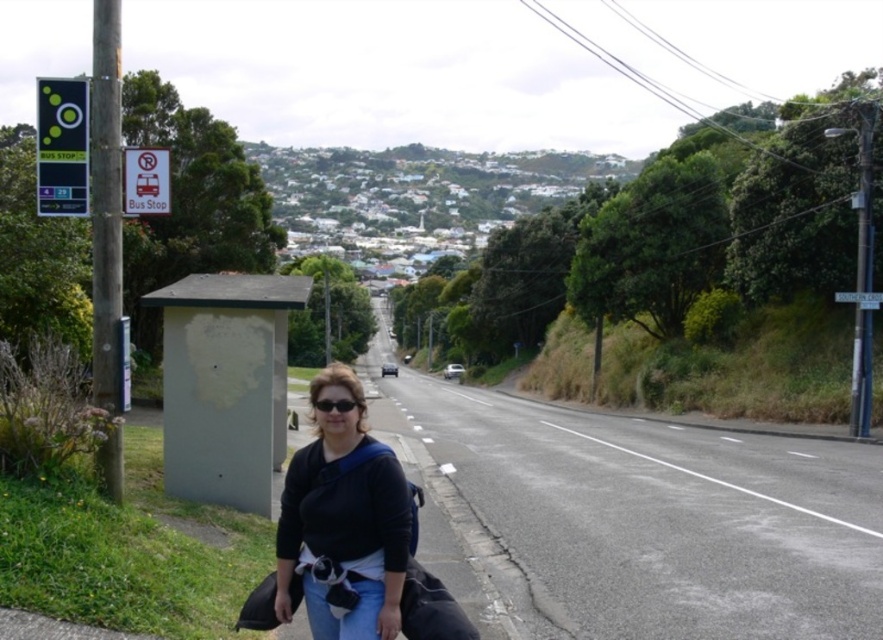
Question: Can you confirm if black fabric bag at center is thinner than metallic bus stop sign at left?

Choices:
 (A) no
 (B) yes

Answer: (A)

Question: Among these objects, which one is farthest from the camera?

Choices:
 (A) black fabric bag at center
 (B) black matte sunglasses at center

Answer: (B)

Question: Which object is positioned closest to the black fabric bag at center?

Choices:
 (A) green plastic bus stop sign at upper left
 (B) black matte sunglasses at center
 (C) metallic bus stop sign at left

Answer: (B)

Question: Which of the following is the farthest from the observer?

Choices:
 (A) metallic bus stop sign at left
 (B) black matte sunglasses at center

Answer: (A)

Question: Considering the relative positions of black fabric bag at center and white plastic street sign at upper right in the image provided, where is black fabric bag at center located with respect to white plastic street sign at upper right?

Choices:
 (A) right
 (B) left

Answer: (B)

Question: Is black fabric bag at center further to the viewer compared to metallic bus stop sign at left?

Choices:
 (A) no
 (B) yes

Answer: (A)